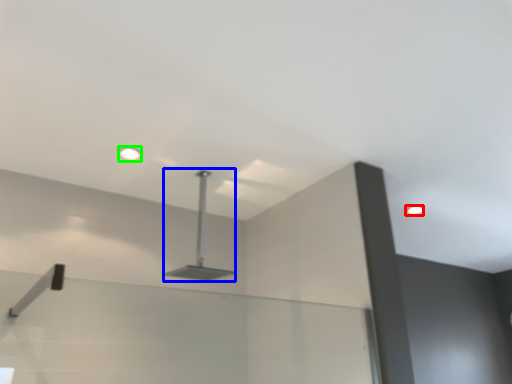
Question: Based on their relative distances, which object is farther from droplight (highlighted by a red box)? Choose from lamp (highlighted by a blue box) and droplight (highlighted by a green box).

Choices:
 (A) lamp
 (B) droplight

Answer: (B)